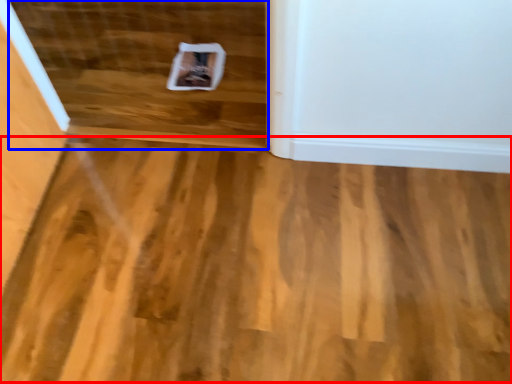
Question: Which object is closer to the camera taking this photo, plywood (highlighted by a red box) or stairwell (highlighted by a blue box)?

Choices:
 (A) plywood
 (B) stairwell

Answer: (A)